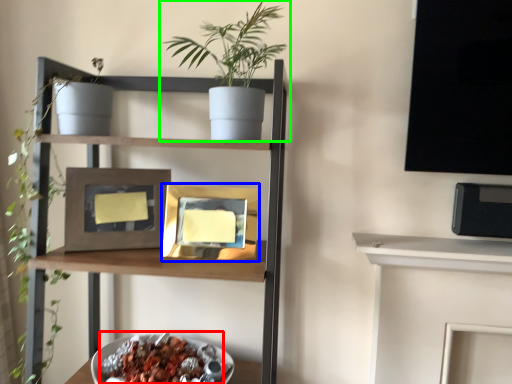
Question: Considering the real-world distances, which object is closest to food (highlighted by a red box)? picture frame (highlighted by a blue box) or houseplant (highlighted by a green box).

Choices:
 (A) picture frame
 (B) houseplant

Answer: (A)